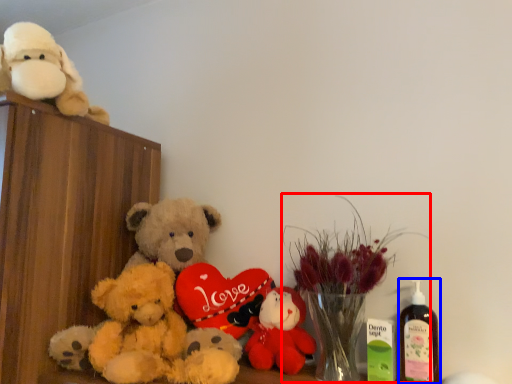
Question: Which of the following is the closest to the observer, floral arrangement (highlighted by a red box) or bottle (highlighted by a blue box)?

Choices:
 (A) floral arrangement
 (B) bottle

Answer: (A)